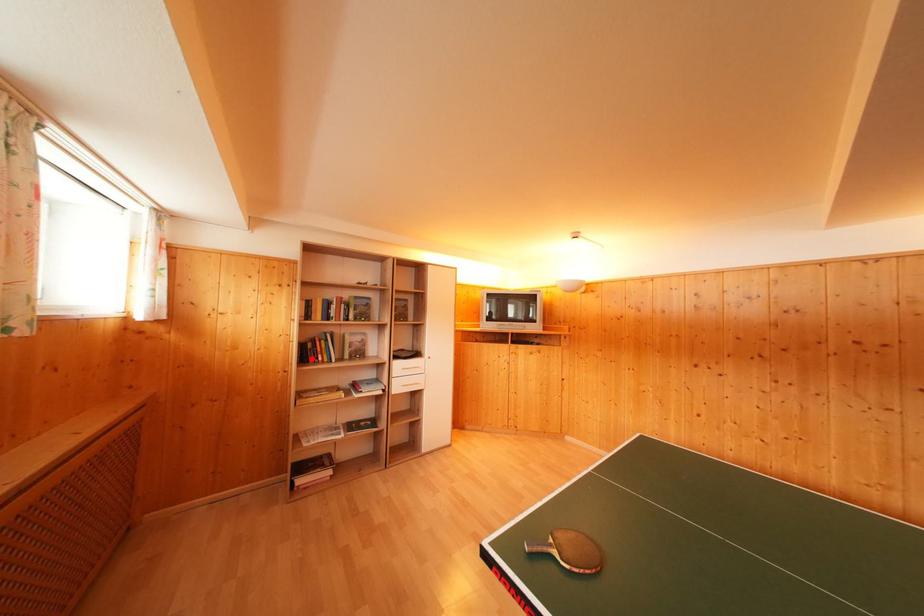
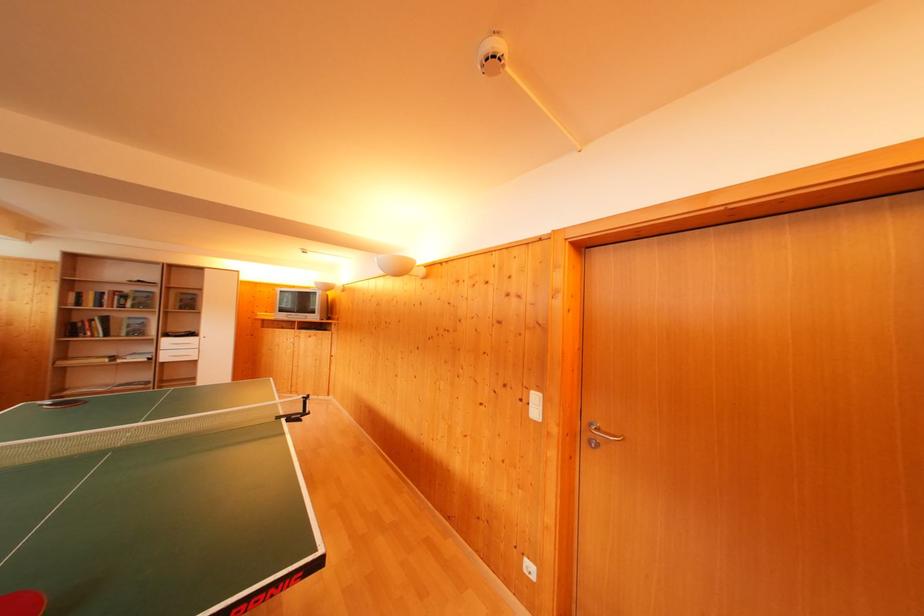
Where in the second image is the point corresponding to the highlighted location from the first image?

(76, 334)